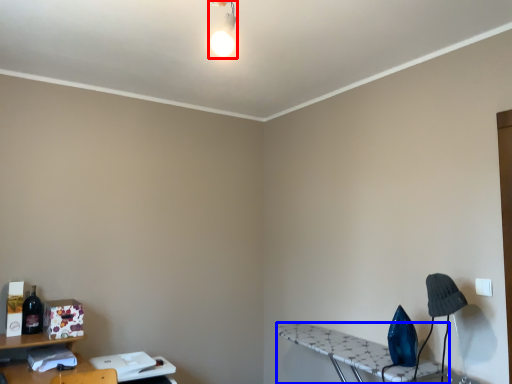
Question: Which of the following is the farthest to the observer, light fixture (highlighted by a red box) or table (highlighted by a blue box)?

Choices:
 (A) light fixture
 (B) table

Answer: (B)